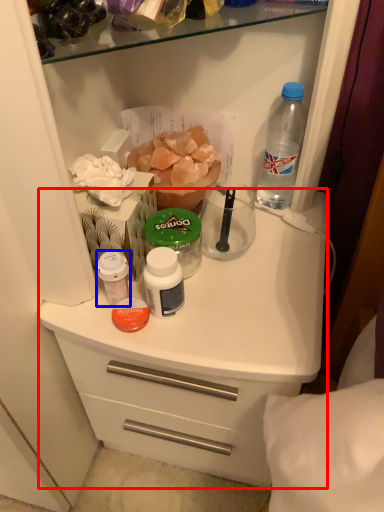
Question: Which point is closer to the camera, counter (highlighted by a red box) or bottle (highlighted by a blue box)?

Choices:
 (A) counter
 (B) bottle

Answer: (A)